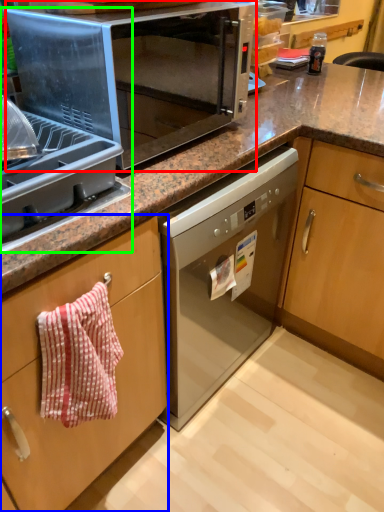
Question: Which object is the closest to the microwave oven (highlighted by a red box)? Choose among these: cabinetry (highlighted by a blue box) or appliance (highlighted by a green box).

Choices:
 (A) cabinetry
 (B) appliance

Answer: (B)